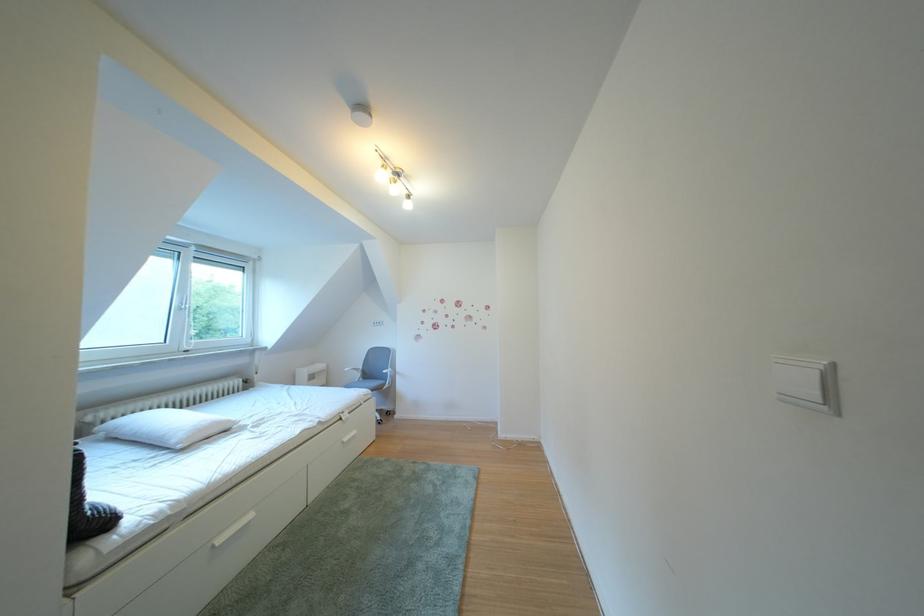
Locate an element on the screen. chair armrest is located at coordinates (353, 369).